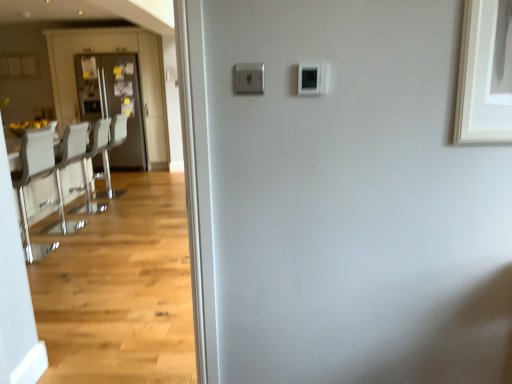
In order to click on vacant space in white glossy armchair at left, placed as the 1th armchair when sorted from front to back (from a real-world perspective) in this screenshot , I will do `click(95, 206)`.